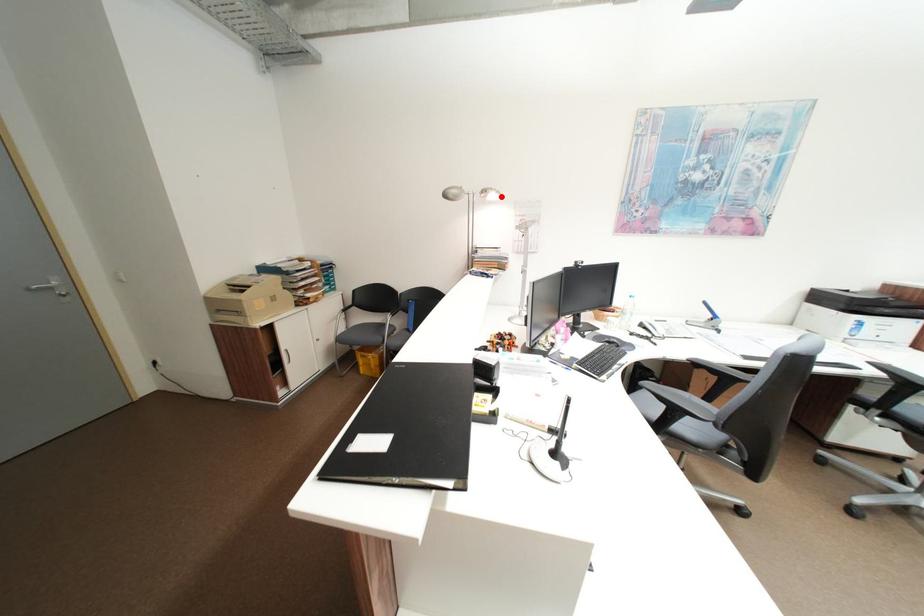
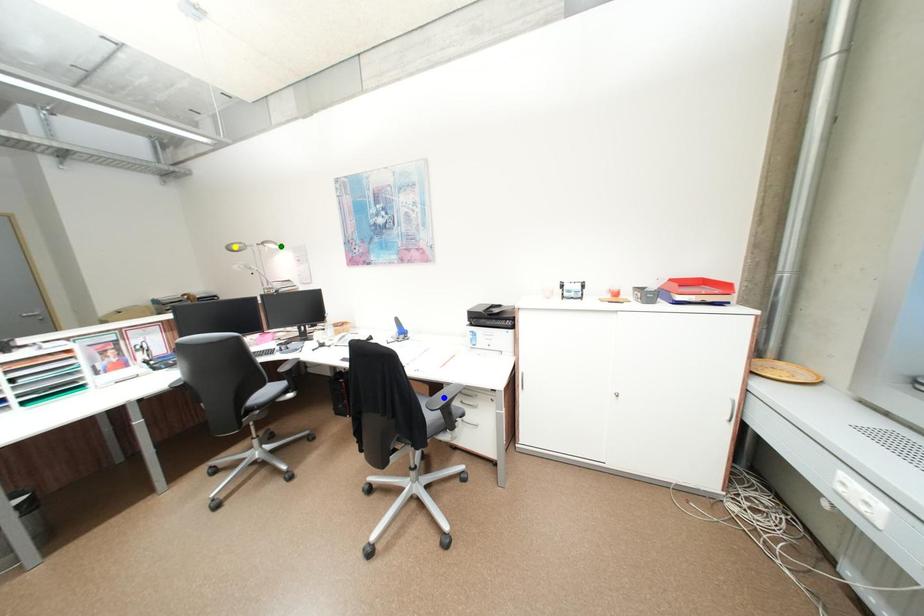
Question: I am providing you with two images of the same scene from different viewpoints. A red point is marked on the first image. You are given multiple points on the second image. Which point in image 2 represents the same 3d spot as the red point in image 1?

Choices:
 (A) green point
 (B) yellow point
 (C) blue point

Answer: (A)